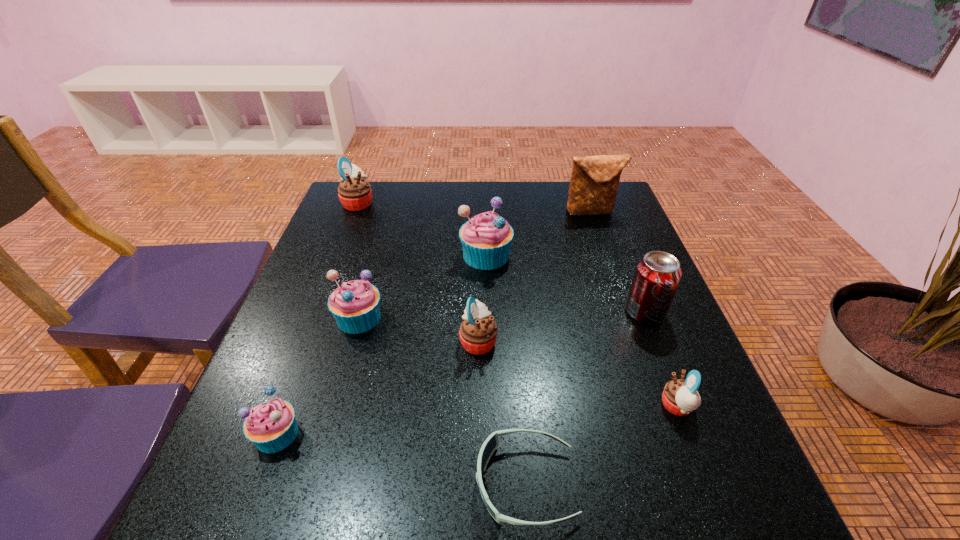
At what (x,y) coordinates should I click in order to perform the action: click on free space located 0.190m on the front-facing side of the smallest pink muffin. Please return your answer as a coordinate pair (x, y). Image resolution: width=960 pixels, height=540 pixels. Looking at the image, I should click on (557, 406).

Where is `free region located 0.100m on the front-facing side of the smallest pink muffin`? The width and height of the screenshot is (960, 540). free region located 0.100m on the front-facing side of the smallest pink muffin is located at coordinates (606, 406).

The height and width of the screenshot is (540, 960). Identify the location of vacant area situated 0.280m on the front-facing side of the smallest pink muffin. (508, 406).

Locate an element on the screen. vacant point located 0.300m on the front-facing side of the goggles is located at coordinates (287, 483).

The width and height of the screenshot is (960, 540). Identify the location of free space located 0.250m on the front-facing side of the goggles. (319, 483).

I want to click on vacant space situated on the front-facing side of the goggles, so click(x=262, y=483).

This screenshot has height=540, width=960. I want to click on clutch bag that is at the far edge, so click(594, 182).

Identify the location of muffin that is at the far edge. (354, 192).

Find the location of a particular element. The height and width of the screenshot is (540, 960). object that is at the near edge is located at coordinates (491, 443).

Identify the location of clutch bag located in the right edge section of the desktop. This screenshot has height=540, width=960. (594, 182).